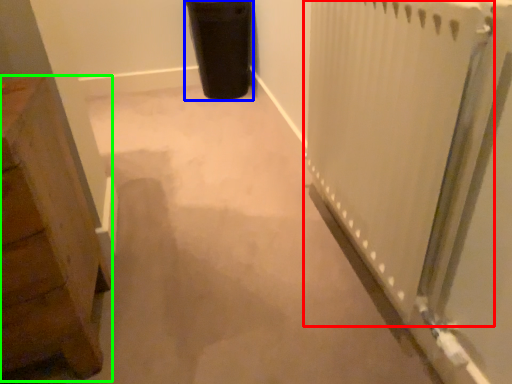
Question: Considering the real-world distances, which object is closest to radiator (highlighted by a red box)? garbage (highlighted by a blue box) or furniture (highlighted by a green box).

Choices:
 (A) garbage
 (B) furniture

Answer: (B)